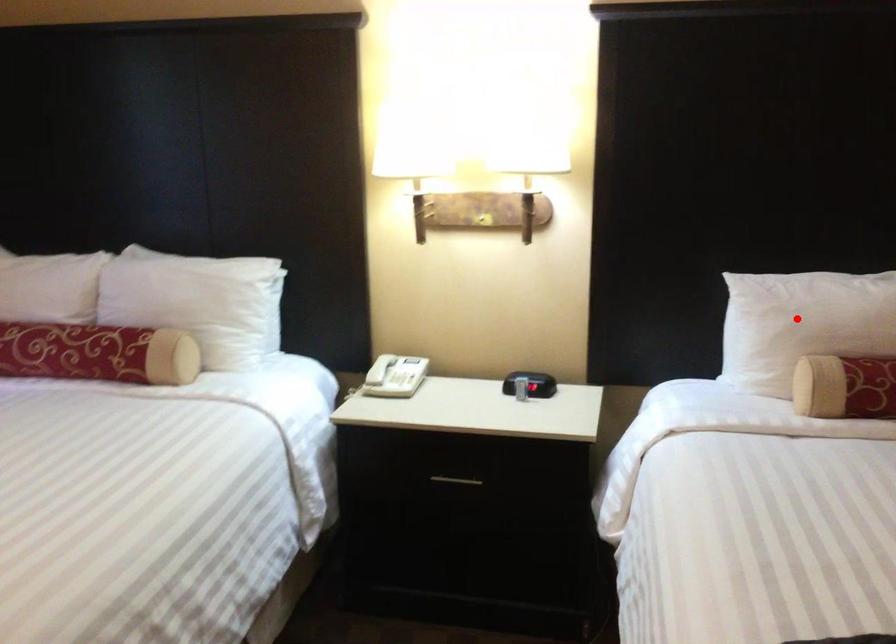
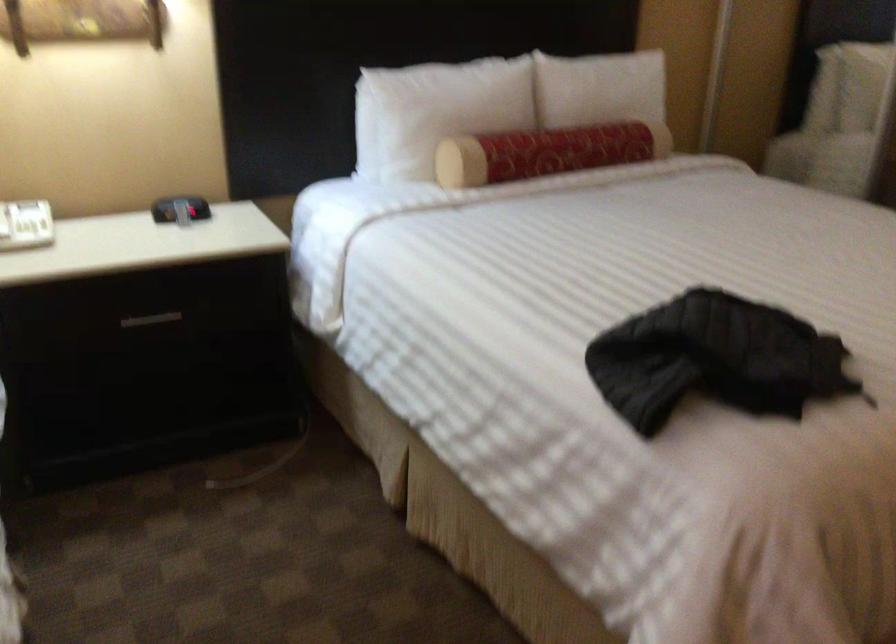
Find the pixel in the second image that matches the highlighted location in the first image.

(435, 111)